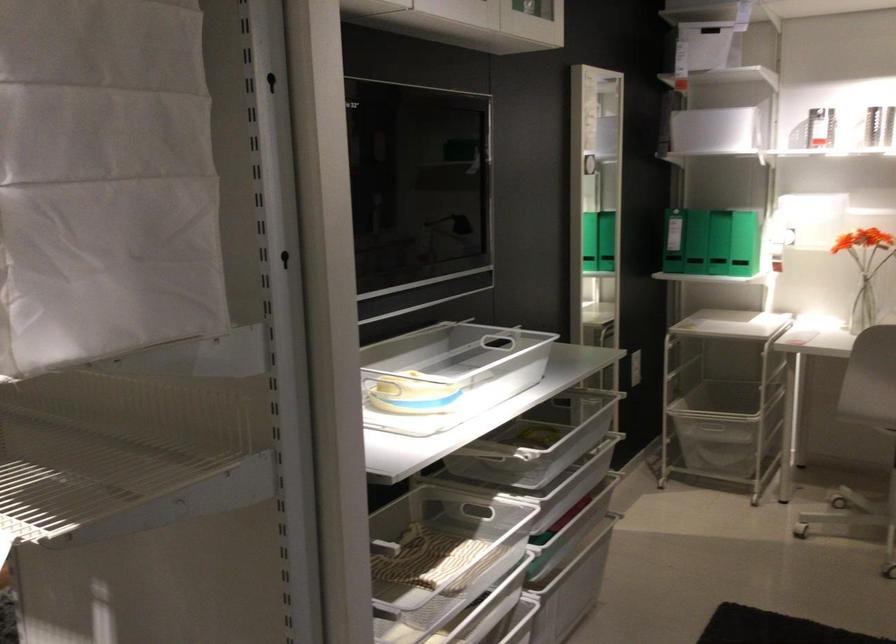
What do you see at coordinates (393, 545) in the screenshot?
I see `the plastic drawer handle` at bounding box center [393, 545].